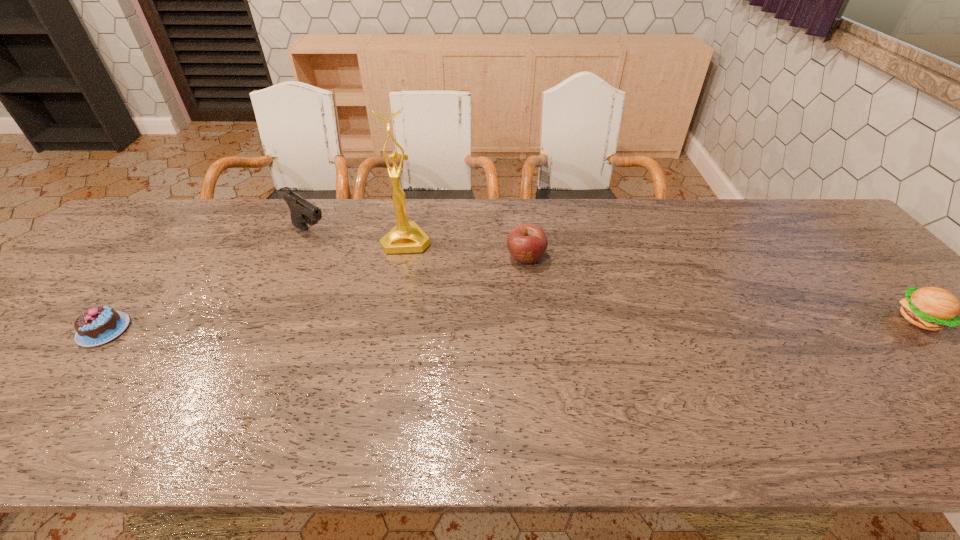
I want to click on the leftmost object, so click(98, 325).

Find the location of a particular element. the shortest object is located at coordinates (98, 325).

You are a GUI agent. You are given a task and a screenshot of the screen. Output one action in this format:
    pyautogui.click(x=<x>, y=<y>)
    Task: Click on the apple
    The height and width of the screenshot is (540, 960).
    Given the screenshot: What is the action you would take?
    pyautogui.click(x=527, y=243)

You are a GUI agent. You are given a task and a screenshot of the screen. Output one action in this format:
    pyautogui.click(x=<x>, y=<y>)
    Task: Click on the third object from left to right
    This screenshot has height=540, width=960.
    Given the screenshot: What is the action you would take?
    pyautogui.click(x=406, y=237)

The image size is (960, 540). I want to click on the tallest object, so click(406, 237).

Find the location of a particular element. the fourth shortest object is located at coordinates (302, 212).

Identify the location of pistol. This screenshot has width=960, height=540. (302, 212).

Where is `free point located on the right of the shortest object`? free point located on the right of the shortest object is located at coordinates (276, 330).

Find the location of a particular element. blank space located 0.390m on the side of the second object from right to left with the unique marking is located at coordinates (448, 376).

Where is `vacant space situated 0.150m on the side of the second object from right to left with the unique marking`? The image size is (960, 540). vacant space situated 0.150m on the side of the second object from right to left with the unique marking is located at coordinates (494, 305).